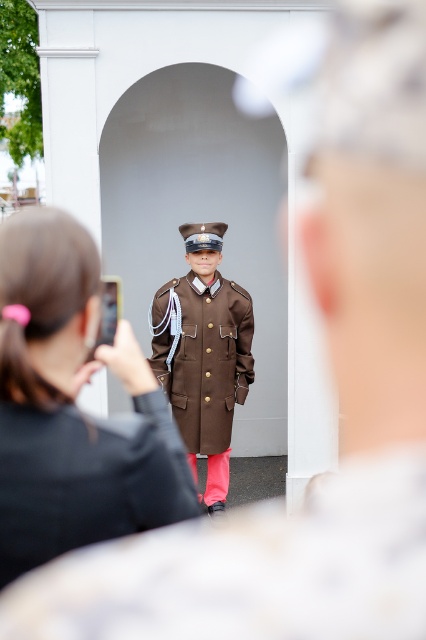
Between matte black hair at center and brown matte uniform at center, which one appears on the right side from the viewer's perspective?

From the viewer's perspective, brown matte uniform at center appears more on the right side.

The image size is (426, 640). Describe the element at coordinates (72, 406) in the screenshot. I see `matte black hair at center` at that location.

What are the coordinates of `matte black hair at center` in the screenshot? It's located at (72, 406).